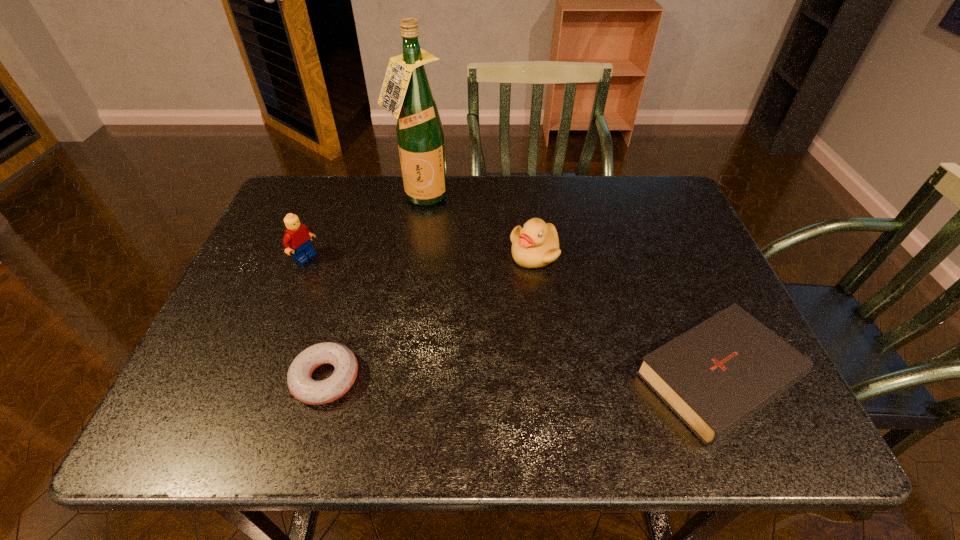
Identify the location of doughnut. The image size is (960, 540). (300, 383).

Where is `the fourth tallest object`? This screenshot has width=960, height=540. the fourth tallest object is located at coordinates (715, 376).

Locate an element on the screen. The height and width of the screenshot is (540, 960). the rightmost object is located at coordinates (715, 376).

You are a GUI agent. You are given a task and a screenshot of the screen. Output one action in this format:
    pyautogui.click(x=<x>, y=<y>)
    Task: Click on the third tallest object
    The image size is (960, 540).
    Given the screenshot: What is the action you would take?
    pyautogui.click(x=536, y=244)

I want to click on the fourth object from left to right, so click(536, 244).

Locate an element on the screen. the fourth shortest object is located at coordinates (298, 236).

Identify the location of Lego. The image size is (960, 540). point(298,236).

Where is `liquor`? The height and width of the screenshot is (540, 960). liquor is located at coordinates (406, 93).

Where is `the tallest object`? The width and height of the screenshot is (960, 540). the tallest object is located at coordinates coord(406,93).

You are a GUI agent. You are given a task and a screenshot of the screen. Output one action in this format:
    pyautogui.click(x=<x>, y=<y>)
    Task: Click on the free space located on the back of the doughnut
    
    Given the screenshot: What is the action you would take?
    pyautogui.click(x=361, y=252)